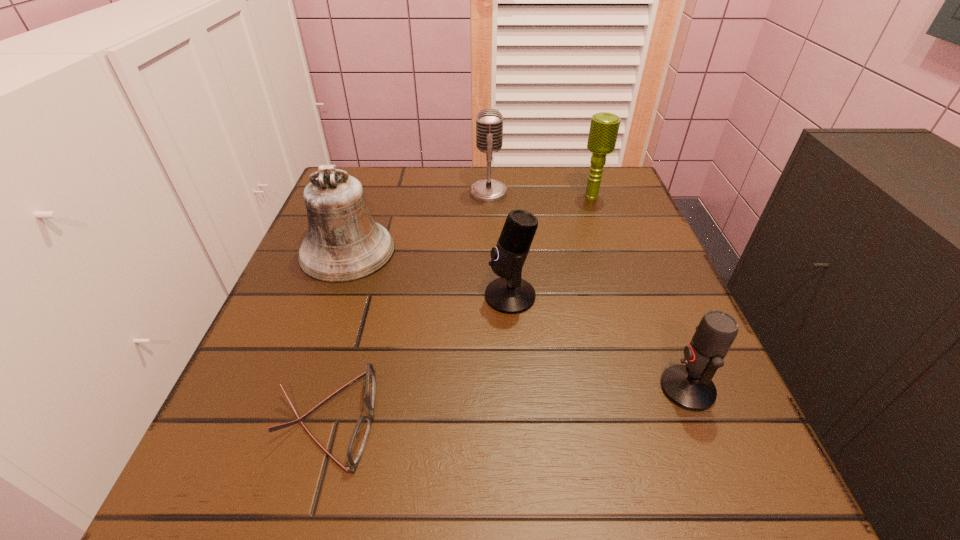
The width and height of the screenshot is (960, 540). Find the location of `vacant space at the right edge`. vacant space at the right edge is located at coordinates (654, 358).

Locate an element on the screen. Image resolution: width=960 pixels, height=540 pixels. vacant space at the far left corner of the desktop is located at coordinates (393, 173).

The height and width of the screenshot is (540, 960). I want to click on vacant space at the near right corner, so click(766, 480).

Image resolution: width=960 pixels, height=540 pixels. I want to click on empty space between the fifth tallest object and the spectacles, so click(508, 404).

This screenshot has width=960, height=540. In order to click on free space between the fifth tallest object and the third farthest microphone in this screenshot , I will do `click(599, 342)`.

The image size is (960, 540). In order to click on empty space that is in between the bell and the shortest object in this screenshot , I will do `click(337, 335)`.

Where is `empty space between the third farthest microphone and the spectacles`? empty space between the third farthest microphone and the spectacles is located at coordinates (419, 357).

The height and width of the screenshot is (540, 960). I want to click on object that is the third closest to the bell, so [358, 440].

Select which object appears as the second closest to the third farthest microphone. Please provide its 2D coordinates. Your answer should be formatted as a tuple, i.e. [(x, y)], where the tuple contains the x and y coordinates of a point satisfying the conditions above.

[(358, 440)]

This screenshot has width=960, height=540. Identify the location of microphone that is the nearest to the nearest microphone. (510, 294).